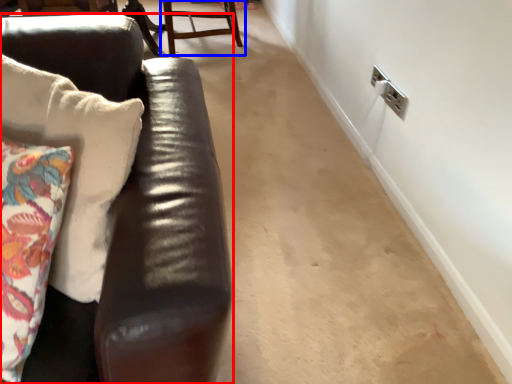
Question: Among these objects, which one is farthest to the camera, studio couch (highlighted by a red box) or chair (highlighted by a blue box)?

Choices:
 (A) studio couch
 (B) chair

Answer: (B)